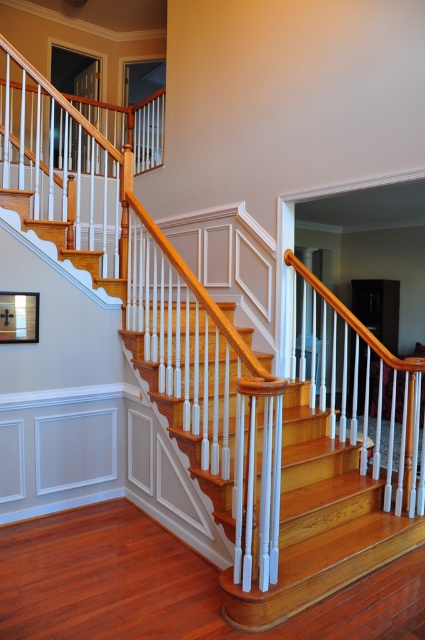
Does light brown wood stairs at center have a lesser height compared to matte black picture frame at upper left?

No.

Between point (337, 560) and point (14, 321), which one is positioned behind?

Point (14, 321)

Find the location of a particular element. light brown wood stairs at center is located at coordinates (320, 522).